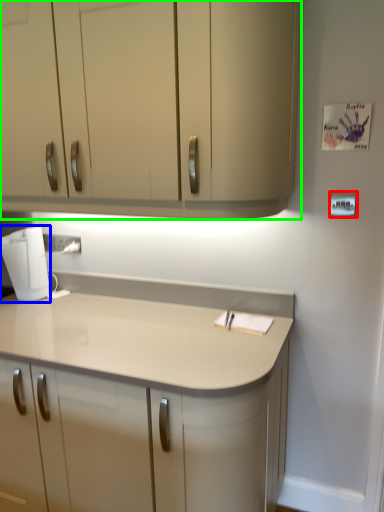
Question: Which is nearer to the light switch (highlighted by a red box)? home appliance (highlighted by a blue box) or cabinetry (highlighted by a green box).

Choices:
 (A) home appliance
 (B) cabinetry

Answer: (B)